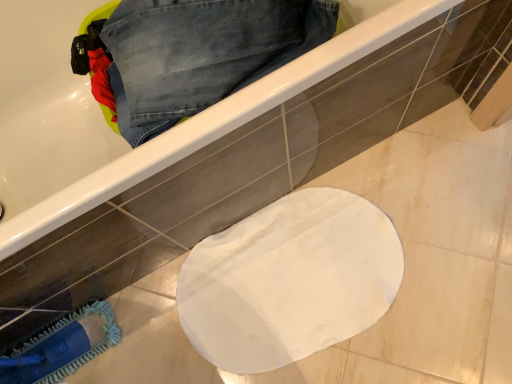
Question: Is white glossy bathtub at upper center taller than blue fabric brush at lower left?

Choices:
 (A) yes
 (B) no

Answer: (A)

Question: Considering the relative sizes of white glossy bathtub at upper center and blue fabric brush at lower left in the image provided, is white glossy bathtub at upper center thinner than blue fabric brush at lower left?

Choices:
 (A) yes
 (B) no

Answer: (B)

Question: From the image's perspective, is white glossy bathtub at upper center above blue fabric brush at lower left?

Choices:
 (A) no
 (B) yes

Answer: (B)

Question: From the image's perspective, is white glossy bathtub at upper center beneath blue fabric brush at lower left?

Choices:
 (A) yes
 (B) no

Answer: (B)

Question: From a real-world perspective, does white glossy bathtub at upper center stand above blue fabric brush at lower left?

Choices:
 (A) no
 (B) yes

Answer: (B)

Question: In terms of width, does white glossy bathtub at upper center look wider or thinner when compared to denim at upper left?

Choices:
 (A) thin
 (B) wide

Answer: (B)

Question: Is point (233, 124) positioned closer to the camera than point (311, 34)?

Choices:
 (A) closer
 (B) farther

Answer: (A)

Question: Is white glossy bathtub at upper center in front of or behind denim at upper left in the image?

Choices:
 (A) behind
 (B) front

Answer: (B)

Question: Do you think white glossy bathtub at upper center is within denim at upper left, or outside of it?

Choices:
 (A) inside
 (B) outside

Answer: (B)

Question: Is blue fabric brush at lower left bigger or smaller than white glossy bathtub at upper center?

Choices:
 (A) big
 (B) small

Answer: (B)

Question: Does point [x=101, y=350] appear closer or farther from the camera than point [x=83, y=187]?

Choices:
 (A) closer
 (B) farther

Answer: (B)

Question: From the image's perspective, is blue fabric brush at lower left positioned above or below white glossy bathtub at upper center?

Choices:
 (A) above
 (B) below

Answer: (B)

Question: Do you think blue fabric brush at lower left is within white glossy bathtub at upper center, or outside of it?

Choices:
 (A) inside
 (B) outside

Answer: (B)

Question: Considering the relative positions of denim at upper left and blue fabric brush at lower left in the image provided, is denim at upper left to the left or to the right of blue fabric brush at lower left?

Choices:
 (A) left
 (B) right

Answer: (B)

Question: From the image's perspective, is denim at upper left positioned above or below blue fabric brush at lower left?

Choices:
 (A) above
 (B) below

Answer: (A)